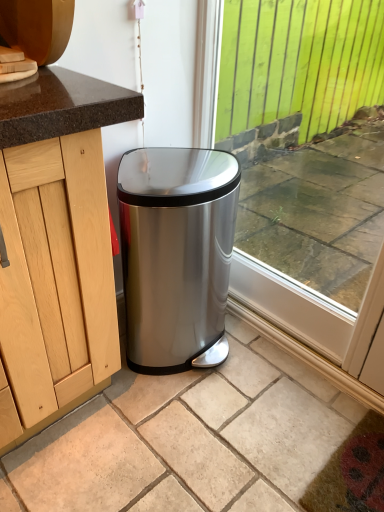
The image size is (384, 512). In order to click on satin metallic trash can at lower center in this screenshot , I will do `click(189, 439)`.

What do you see at coordinates (189, 439) in the screenshot? I see `satin metallic trash can at lower center` at bounding box center [189, 439].

Measure the distance between satin metallic trash can at lower center and camera.

A distance of 3.42 feet exists between satin metallic trash can at lower center and camera.

Image resolution: width=384 pixels, height=512 pixels. Describe the element at coordinates (299, 62) in the screenshot. I see `transparent glass window at center` at that location.

Locate an element on the screen. The width and height of the screenshot is (384, 512). transparent glass window at center is located at coordinates (299, 62).

Identify the location of satin metallic trash can at lower center. Image resolution: width=384 pixels, height=512 pixels. (189, 439).

Considering the positions of objects satin metallic trash can at lower center and transparent glass window at center in the image provided, who is more to the left, satin metallic trash can at lower center or transparent glass window at center?

satin metallic trash can at lower center.

Does satin metallic trash can at lower center come in front of transparent glass window at center?

Yes, satin metallic trash can at lower center is in front of transparent glass window at center.

Is point (140, 396) closer to viewer compared to point (319, 14)?

That is True.

From the image's perspective, is satin metallic trash can at lower center above or below transparent glass window at center?

Based on their image positions, satin metallic trash can at lower center is located beneath transparent glass window at center.

From a real-world perspective, does satin metallic trash can at lower center sit lower than transparent glass window at center?

Yes, from a real-world perspective, satin metallic trash can at lower center is below transparent glass window at center.

Does satin metallic trash can at lower center have a greater width compared to transparent glass window at center?

Indeed, satin metallic trash can at lower center has a greater width compared to transparent glass window at center.

In terms of height, does satin metallic trash can at lower center look taller or shorter compared to transparent glass window at center?

Clearly, satin metallic trash can at lower center is shorter compared to transparent glass window at center.

Who is smaller, satin metallic trash can at lower center or transparent glass window at center?

satin metallic trash can at lower center.

Is satin metallic trash can at lower center surrounding transparent glass window at center?

No.

Is satin metallic trash can at lower center not near transparent glass window at center?

Yes, satin metallic trash can at lower center and transparent glass window at center are quite far apart.

Could you tell me if satin metallic trash can at lower center is facing transparent glass window at center?

No, satin metallic trash can at lower center is not turned towards transparent glass window at center.

What's the angular difference between satin metallic trash can at lower center and transparent glass window at center's facing directions?

They differ by 0.0544 degrees in their facing directions.

How distant is satin metallic trash can at lower center from transparent glass window at center?

They are 2.06 meters apart.

Locate an element on the screen. The width and height of the screenshot is (384, 512). granite below the transparent glass window at center (from the image's perspective) is located at coordinates (189, 439).

Consider the image. Can you confirm if transparent glass window at center is positioned to the left of satin metallic trash can at lower center?

No, transparent glass window at center is not to the left of satin metallic trash can at lower center.

Is transparent glass window at center in front of satin metallic trash can at lower center?

No, transparent glass window at center is further to the viewer.

Does point (319, 113) come farther from viewer compared to point (289, 364)?

Yes, it is behind point (289, 364).

From the image's perspective, which one is positioned lower, transparent glass window at center or satin metallic trash can at lower center?

satin metallic trash can at lower center.

From a real-world perspective, is transparent glass window at center below satin metallic trash can at lower center?

Actually, transparent glass window at center is physically above satin metallic trash can at lower center in the real world.

Looking at this image, in terms of width, does transparent glass window at center look wider or thinner when compared to satin metallic trash can at lower center?

transparent glass window at center is thinner than satin metallic trash can at lower center.

Looking at this image, does transparent glass window at center have a lesser height compared to satin metallic trash can at lower center?

No.

In terms of size, does transparent glass window at center appear bigger or smaller than satin metallic trash can at lower center?

Considering their sizes, transparent glass window at center takes up more space than satin metallic trash can at lower center.

Consider the image. Is transparent glass window at center not within satin metallic trash can at lower center?

Yes.

Is transparent glass window at center touching satin metallic trash can at lower center?

No.

Does transparent glass window at center turn towards satin metallic trash can at lower center?

Yes, transparent glass window at center is facing satin metallic trash can at lower center.

How many degrees apart are the facing directions of transparent glass window at center and satin metallic trash can at lower center?

They differ by 0.0544 degrees in their facing directions.

Identify the location of granite in front of the transparent glass window at center. The image size is (384, 512). (189, 439).

What are the coordinates of `granite on the left side of transparent glass window at center` in the screenshot? It's located at (189, 439).

This screenshot has width=384, height=512. What are the coordinates of `granite that appears below the transparent glass window at center (from a real-world perspective)` in the screenshot? It's located at (189, 439).